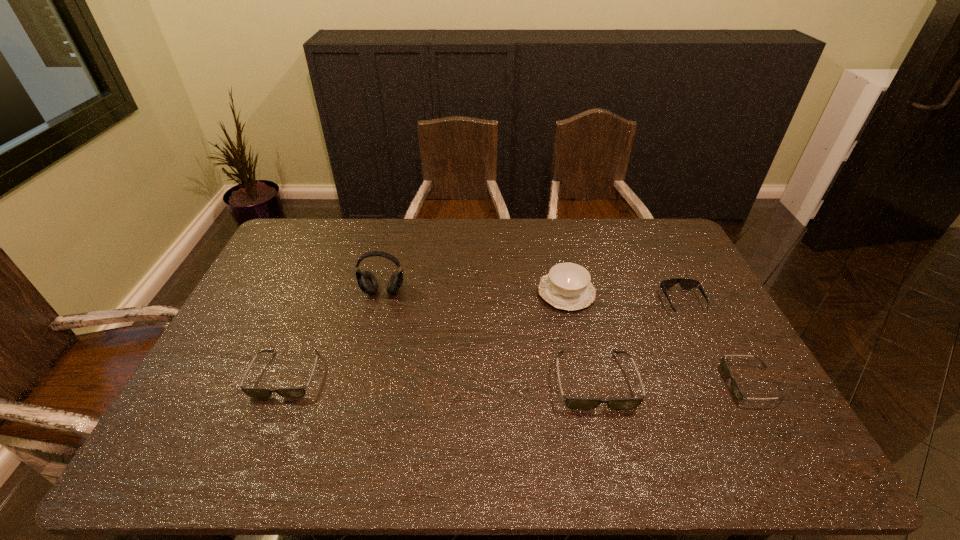
This screenshot has width=960, height=540. I want to click on vacant area situated on the front-facing side of the shortest sunglasses, so click(617, 383).

The height and width of the screenshot is (540, 960). In order to click on vacant region located on the ear cups of the tallest object in this screenshot , I will do `click(369, 348)`.

The image size is (960, 540). What are the coordinates of `vacant space located on the front-facing side of the farthest sunglasses` in the screenshot? It's located at (721, 379).

Identify the location of vacant space situated 0.190m on the handle side of the chinaware. This screenshot has width=960, height=540. (479, 293).

Locate an element on the screen. The width and height of the screenshot is (960, 540). free space located 0.250m on the handle side of the chinaware is located at coordinates (461, 293).

You are a GUI agent. You are given a task and a screenshot of the screen. Output one action in this format:
    pyautogui.click(x=<x>, y=<y>)
    Task: Click on the free space located 0.400m on the handle side of the chinaware
    The width and height of the screenshot is (960, 540).
    Given the screenshot: What is the action you would take?
    pyautogui.click(x=415, y=293)

Locate an element on the screen. The width and height of the screenshot is (960, 540). object present at the left edge is located at coordinates (252, 392).

The width and height of the screenshot is (960, 540). Find the location of `object located in the near left corner section of the desktop`. object located in the near left corner section of the desktop is located at coordinates (252, 392).

Image resolution: width=960 pixels, height=540 pixels. I want to click on object located in the near right corner section of the desktop, so click(x=739, y=395).

Image resolution: width=960 pixels, height=540 pixels. In the image, there is a desktop. In order to click on vacant area at the far edge in this screenshot , I will do `click(619, 228)`.